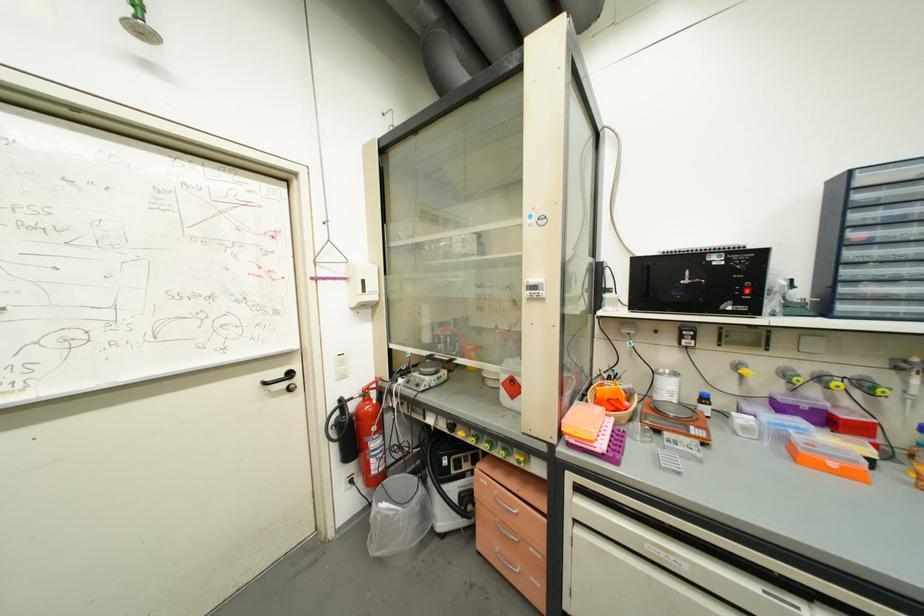
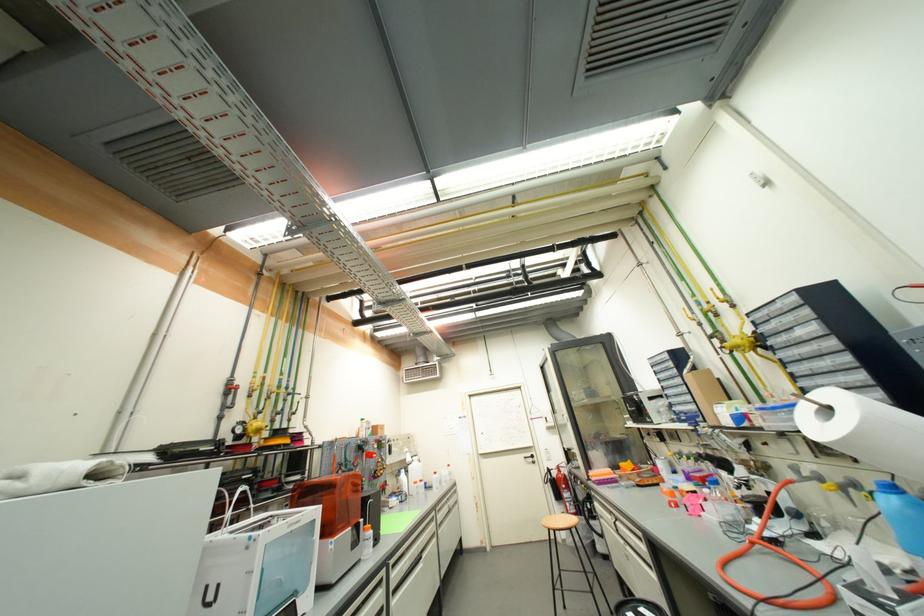
In the second image, find the point that corresponds to (350,400) in the first image.

(554, 469)